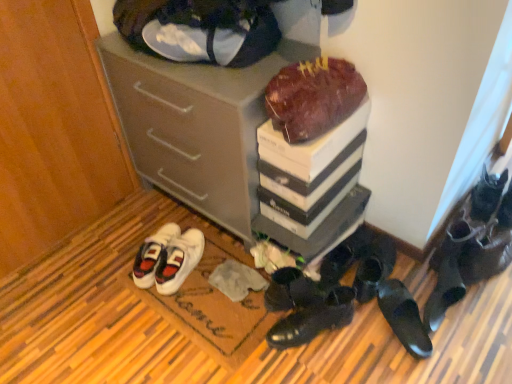
Identify the location of free space on the front side of shiny black shoes at lower right, which is the 5th footwear from right to left. The height and width of the screenshot is (384, 512). (375, 331).